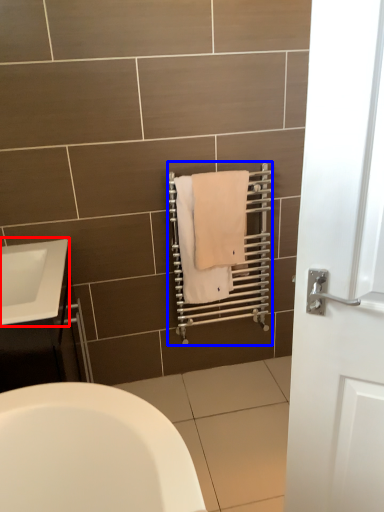
Question: Which object is closer to the camera taking this photo, sink (highlighted by a red box) or balustrade (highlighted by a blue box)?

Choices:
 (A) sink
 (B) balustrade

Answer: (A)